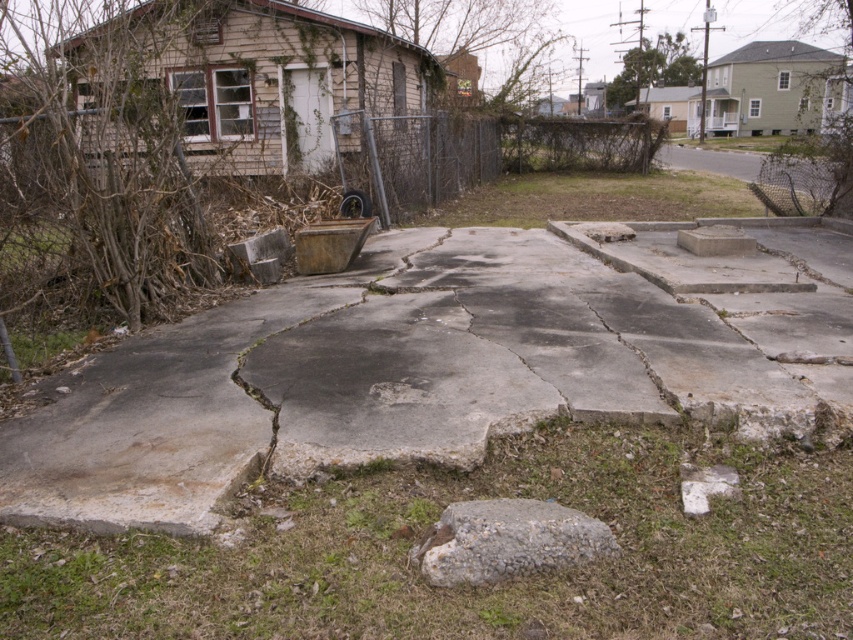
Based on the photo, you are standing in front of the gray concrete pavement at center and the gray rough stone at lower center. Which object is closer to you?

The gray concrete pavement at center is closer to you because it is further to the viewer than the gray rough stone at lower center.